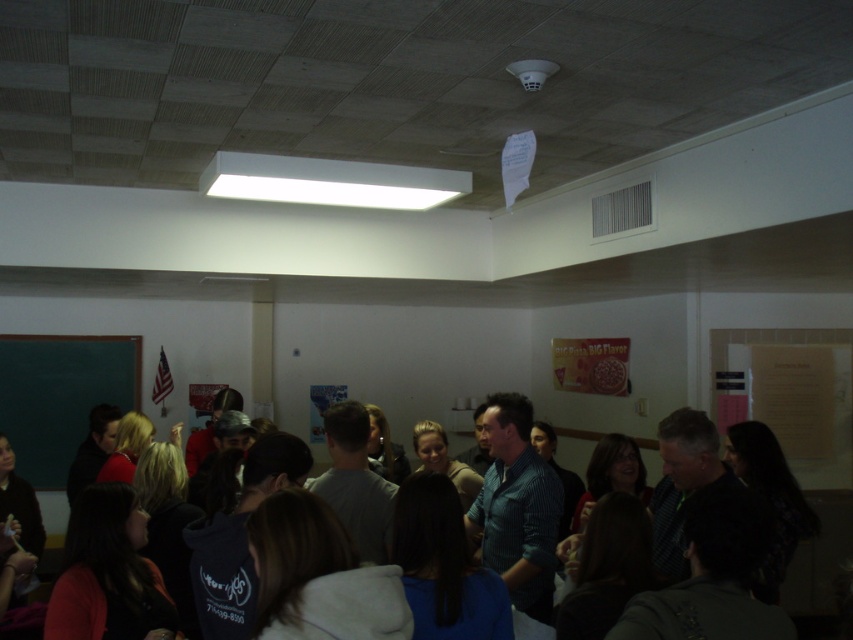
Is green chalkboard at left shorter than blue striped shirt at center?

No, green chalkboard at left is not shorter than blue striped shirt at center.

Find the location of a particular element. This screenshot has height=640, width=853. green chalkboard at left is located at coordinates (61, 396).

Is blue denim shirt at center thinner than green chalkboard at left?

Incorrect, blue denim shirt at center's width is not less than green chalkboard at left's.

Between blue denim shirt at center and green chalkboard at left, which one is positioned higher?

green chalkboard at left

What do you see at coordinates (718, 483) in the screenshot?
I see `blue denim shirt at center` at bounding box center [718, 483].

This screenshot has width=853, height=640. In order to click on blue denim shirt at center in this screenshot , I will do `click(718, 483)`.

Can you confirm if blue denim shirt at center is positioned to the right of blue striped shirt at center?

Indeed, blue denim shirt at center is positioned on the right side of blue striped shirt at center.

Consider the image. Which of these two, blue denim shirt at center or blue striped shirt at center, stands taller?

blue striped shirt at center

Is point (495, 416) closer to camera compared to point (535, 504)?

No, it is behind (535, 504).

You are a GUI agent. You are given a task and a screenshot of the screen. Output one action in this format:
    pyautogui.click(x=<x>, y=<y>)
    Task: Click on the blue denim shirt at center
    Image resolution: width=853 pixels, height=640 pixels.
    Given the screenshot: What is the action you would take?
    pyautogui.click(x=718, y=483)